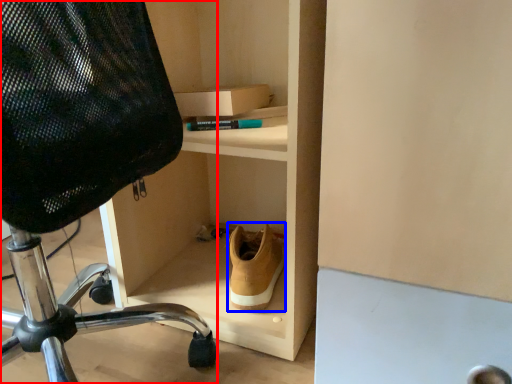
Question: Which object appears closest to the camera in this image, chair (highlighted by a red box) or shoe (highlighted by a blue box)?

Choices:
 (A) chair
 (B) shoe

Answer: (A)